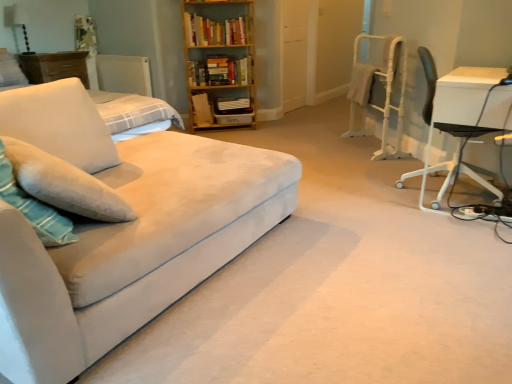
This screenshot has height=384, width=512. I want to click on white soft pillow at upper left, the first pillow viewed from the left, so click(10, 70).

Describe the element at coordinates (18, 22) in the screenshot. I see `white fabric lampshade at upper left` at that location.

You are a GUI agent. You are given a task and a screenshot of the screen. Output one action in this format:
    pyautogui.click(x=<x>, y=<y>)
    Task: Click on the wooden bookshelf at upper center, arranged as the 1th book when viewed from the top
    This screenshot has height=384, width=512.
    Given the screenshot: What is the action you would take?
    (x=217, y=31)

Image resolution: width=512 pixels, height=384 pixels. What do you see at coordinates (59, 123) in the screenshot? I see `white soft pillow at left, which is counted as the first pillow, starting from the right` at bounding box center [59, 123].

You are a GUI agent. You are given a task and a screenshot of the screen. Output one action in this format:
    pyautogui.click(x=<x>, y=<y>)
    Task: Click on the white matte radiator at upper left
    
    Given the screenshot: What is the action you would take?
    pyautogui.click(x=124, y=74)

Does wooden dresser at upper left have a lesser width compared to black plastic chair at right?

Indeed, wooden dresser at upper left has a lesser width compared to black plastic chair at right.

From the image's perspective, is wooden dresser at upper left located beneath black plastic chair at right?

Incorrect, from the image's perspective, wooden dresser at upper left is higher than black plastic chair at right.

Which object is more forward, wooden dresser at upper left or black plastic chair at right?

black plastic chair at right is more forward.

Which is behind, point (89, 86) or point (463, 165)?

The point (89, 86) is more distant.

From the image's perspective, which is below, white soft pillow at upper left, which is the 2th pillow from right to left, or wooden bookshelf at upper center?

white soft pillow at upper left, which is the 2th pillow from right to left, is shown below in the image.

Is white soft pillow at upper left, the 1th pillow positioned from the top, positioned beyond the bounds of wooden bookshelf at upper center?

white soft pillow at upper left, the 1th pillow positioned from the top, lies outside wooden bookshelf at upper center's area.

Is point (1, 64) closer to camera compared to point (194, 41)?

Yes, point (1, 64) is in front of point (194, 41).

Is white soft pillow at upper left, placed as the first pillow when sorted from back to front, oriented away from wooden bookshelf at upper center?

That's not correct — white soft pillow at upper left, placed as the first pillow when sorted from back to front, is not looking away from wooden bookshelf at upper center.

In the scene shown: Which is more to the right, white metal computer chair at right or white fabric lampshade at upper left?

white metal computer chair at right is more to the right.

Which is in front, point (396, 137) or point (26, 34)?

The point (396, 137) is closer.

Does white metal computer chair at right have a larger size compared to white fabric lampshade at upper left?

Yes.

Can you tell me how much white metal computer chair at right and white fabric lampshade at upper left differ in facing direction?

white metal computer chair at right and white fabric lampshade at upper left are facing 138 degrees away from each other.

Is wooden bookshelf at upper center positioned far away from wooden bookshelf at upper center, arranged as the 1th book when viewed from the top?

No.

Which of these two, wooden bookshelf at upper center or wooden bookshelf at upper center, arranged as the 1th book when viewed from the top, is wider?

wooden bookshelf at upper center.

Does wooden bookshelf at upper center have a lesser height compared to wooden bookshelf at upper center, arranged as the 1th book when viewed from the top?

No.

How many degrees apart are the facing directions of wooden bookshelf at upper center and wooden bookshelf at upper center, which is counted as the second book, starting from the bottom?

They differ by 0.805 degrees in their facing directions.

Is wooden bookshelf at upper center, which is counted as the second book, starting from the bottom, not close to white soft pillow at upper left, which is the 2th pillow in front-to-back order?

Yes.

Where is `the 1st pillow below the wooden bookshelf at upper center, which is counted as the second book, starting from the bottom (from a real-world perspective)`? The height and width of the screenshot is (384, 512). the 1st pillow below the wooden bookshelf at upper center, which is counted as the second book, starting from the bottom (from a real-world perspective) is located at coordinates (10, 70).

Could you tell me if wooden bookshelf at upper center, arranged as the 1th book when viewed from the top, is facing white soft pillow at upper left, acting as the 2th pillow starting from the bottom?

No.

In the scene shown: Does wooden bookshelf at upper center, arranged as the 1th book when viewed from the top, appear on the left side of white soft pillow at upper left, the 1th pillow positioned from the top?

In fact, wooden bookshelf at upper center, arranged as the 1th book when viewed from the top, is to the right of white soft pillow at upper left, the 1th pillow positioned from the top.

Considering the positions of points (9, 61) and (80, 167), is point (9, 61) farther from camera compared to point (80, 167)?

Yes, it is behind point (80, 167).

How different are the orientations of white soft pillow at upper left, the 1th pillow positioned from the top, and white soft pillow at left, which ranks as the 1th pillow in bottom-to-top order, in degrees?

A: The angular difference between white soft pillow at upper left, the 1th pillow positioned from the top, and white soft pillow at left, which ranks as the 1th pillow in bottom-to-top order, is 0.795 degrees.

Is white soft pillow at upper left, which is the 2th pillow in front-to-back order, facing away from white soft pillow at left, acting as the second pillow starting from the left?

No, white soft pillow at left, acting as the second pillow starting from the left, is not at the back of white soft pillow at upper left, which is the 2th pillow in front-to-back order.

What's the angular difference between white soft pillow at upper left, acting as the 2th pillow starting from the bottom, and suede-like beige couch at left's facing directions?

There is a 0.795-degree angle between the facing directions of white soft pillow at upper left, acting as the 2th pillow starting from the bottom, and suede-like beige couch at left.

Which object is thinner, white soft pillow at upper left, the first pillow viewed from the left, or suede-like beige couch at left?

white soft pillow at upper left, the first pillow viewed from the left, is thinner.

Do you think white soft pillow at upper left, which is the 2th pillow in front-to-back order, is within suede-like beige couch at left, or outside of it?

white soft pillow at upper left, which is the 2th pillow in front-to-back order, cannot be found inside suede-like beige couch at left.

Locate an element on the screen. This screenshot has height=384, width=512. chair below the wooden dresser at upper left (from the image's perspective) is located at coordinates (433, 105).

Where is `bookcase behind the white soft pillow at upper left, the first pillow viewed from the left`? This screenshot has width=512, height=384. bookcase behind the white soft pillow at upper left, the first pillow viewed from the left is located at coordinates (220, 63).

Based on their spatial positions, is white soft pillow at left, acting as the second pillow starting from the left, or wooden bookshelf at upper center, which is counted as the second book, starting from the bottom, closer to white metal computer chair at right?

wooden bookshelf at upper center, which is counted as the second book, starting from the bottom.

Looking at the image, which one is located closer to white soft pillow at left, the second pillow positioned from the top, wooden bookshelf at center, placed as the 2th book when sorted from top to bottom, or white matte radiator at upper left?

wooden bookshelf at center, placed as the 2th book when sorted from top to bottom, is positioned closer to the anchor white soft pillow at left, the second pillow positioned from the top.

Based on the photo, which object lies nearer to the anchor point white soft pillow at left, the second pillow positioned from the top, white fabric lampshade at upper left or white soft pillow at upper left, the 1th pillow positioned from the top?

white soft pillow at upper left, the 1th pillow positioned from the top, is positioned closer to the anchor white soft pillow at left, the second pillow positioned from the top.

Consider the image. Based on their spatial positions, is suede-like beige couch at left or black plastic chair at right further from wooden bookshelf at center, placed as the 2th book when sorted from top to bottom?

suede-like beige couch at left.

From the image, which object appears to be farther from wooden bookshelf at center, placed as the 2th book when sorted from top to bottom, white soft pillow at left, which is counted as the first pillow, starting from the front, or white metal computer chair at right?

white soft pillow at left, which is counted as the first pillow, starting from the front, is further to wooden bookshelf at center, placed as the 2th book when sorted from top to bottom.

Consider the image. Based on their spatial positions, is suede-like beige couch at left or white matte radiator at upper left closer to white fabric lampshade at upper left?

white matte radiator at upper left lies closer to white fabric lampshade at upper left than the other object.

When comparing their distances from wooden bookshelf at upper center, does white matte radiator at upper left or wooden bookshelf at upper center, arranged as the 1th book when viewed from the top, seem closer?

wooden bookshelf at upper center, arranged as the 1th book when viewed from the top, is positioned closer to the anchor wooden bookshelf at upper center.

From the picture: Looking at the image, which one is located further to white fabric lampshade at upper left, wooden bookshelf at upper center, which is counted as the second book, starting from the bottom, or white matte radiator at upper left?

wooden bookshelf at upper center, which is counted as the second book, starting from the bottom.

Where is `computer chair between white fabric lampshade at upper left and black plastic chair at right`? This screenshot has width=512, height=384. computer chair between white fabric lampshade at upper left and black plastic chair at right is located at coordinates (384, 89).

You are a GUI agent. You are given a task and a screenshot of the screen. Output one action in this format:
    pyautogui.click(x=<x>, y=<y>)
    Task: Click on the bookcase between suede-like beige couch at left and wooden bookshelf at center, which appears as the 1th book when ordered from the bottom, along the z-axis
    
    Given the screenshot: What is the action you would take?
    point(220,63)

Identify the location of computer chair between suede-like beige couch at left and wooden bookshelf at upper center, which is counted as the second book, starting from the bottom, from front to back. (384, 89).

Where is `book between wooden bookshelf at upper center, which is counted as the second book, starting from the bottom, and white metal computer chair at right`? book between wooden bookshelf at upper center, which is counted as the second book, starting from the bottom, and white metal computer chair at right is located at coordinates (221, 71).